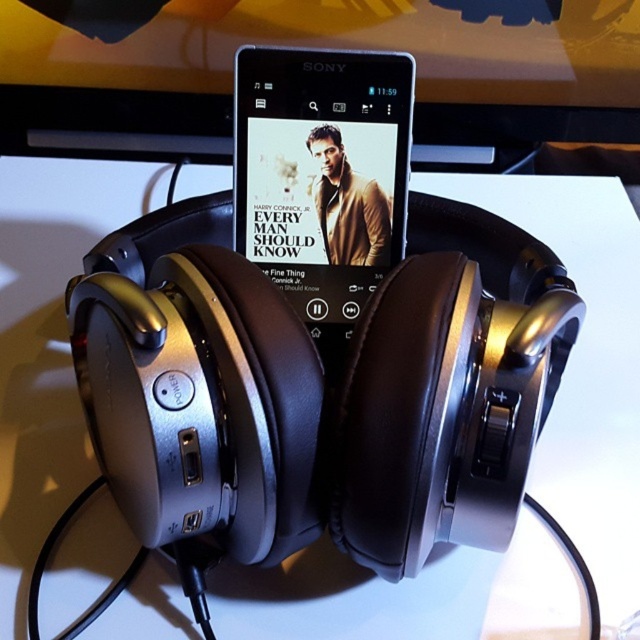
Question: From the image, what is the correct spatial relationship of white matte table at center in relation to satin black phone at center?

Choices:
 (A) below
 (B) above

Answer: (A)

Question: Which object appears closest to the camera in this image?

Choices:
 (A) satin black phone at center
 (B) white matte table at center

Answer: (B)

Question: Is white matte table at center closer to the viewer compared to satin black phone at center?

Choices:
 (A) no
 (B) yes

Answer: (B)

Question: Is white matte table at center to the right of satin black phone at center from the viewer's perspective?

Choices:
 (A) no
 (B) yes

Answer: (B)